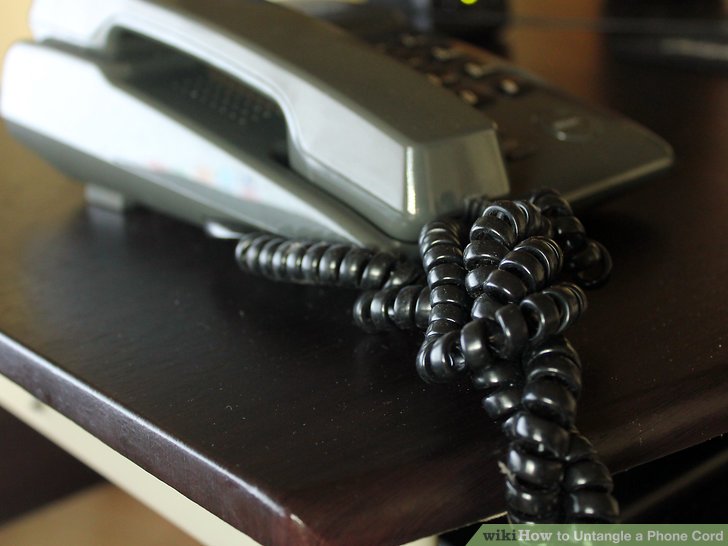
Image resolution: width=728 pixels, height=546 pixels. Find the location of `desk`. desk is located at coordinates (124, 319).